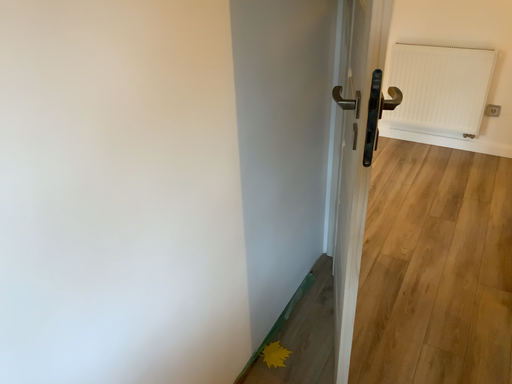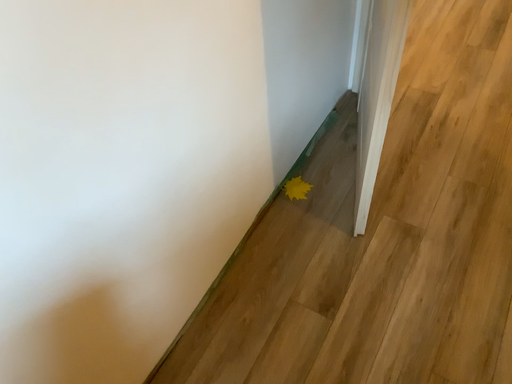
Question: Which way did the camera rotate in the video?

Choices:
 (A) rotated downward
 (B) rotated upward

Answer: (A)